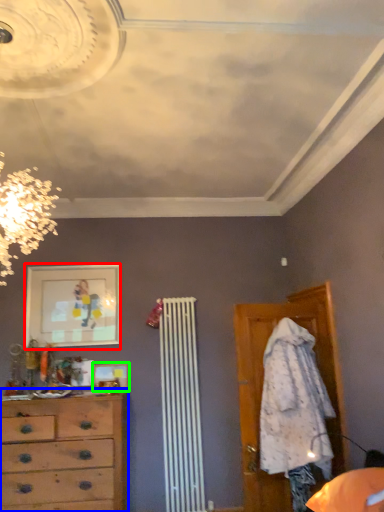
Question: Considering the real-world distances, which object is farthest from picture frame (highlighted by a red box)? chest of drawers (highlighted by a blue box) or picture frame (highlighted by a green box)?

Choices:
 (A) chest of drawers
 (B) picture frame

Answer: (A)